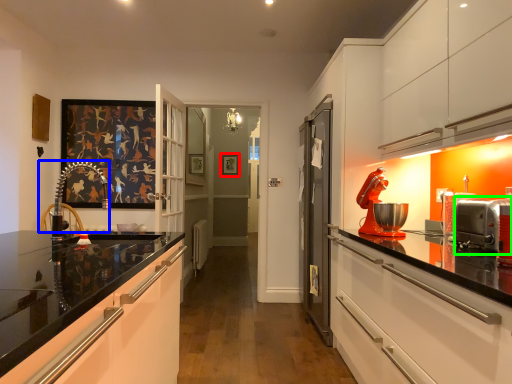
Question: Estimate the real-world distances between objects in this image. Which object is closer to picture frame (highlighted by a red box), chair (highlighted by a blue box) or appliance (highlighted by a green box)?

Choices:
 (A) chair
 (B) appliance

Answer: (A)